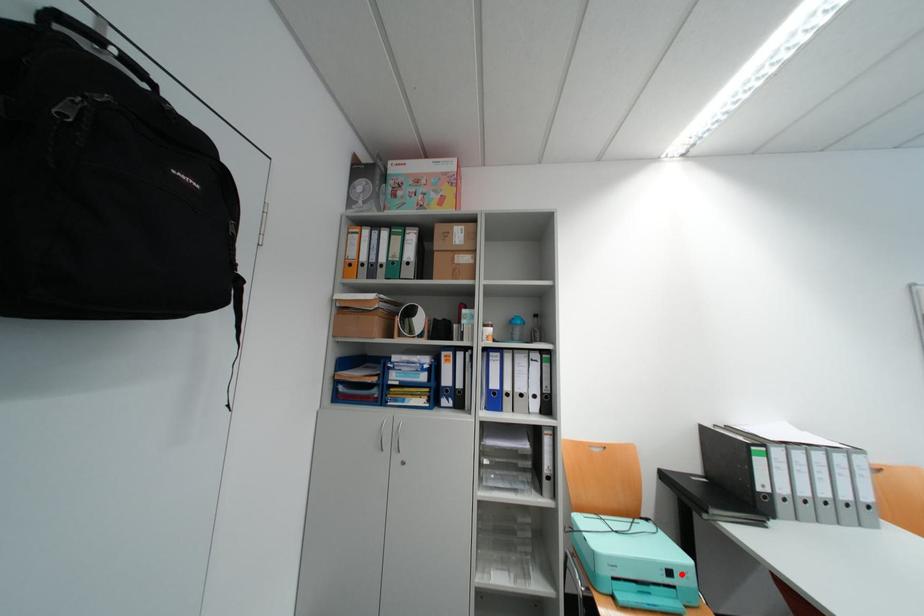
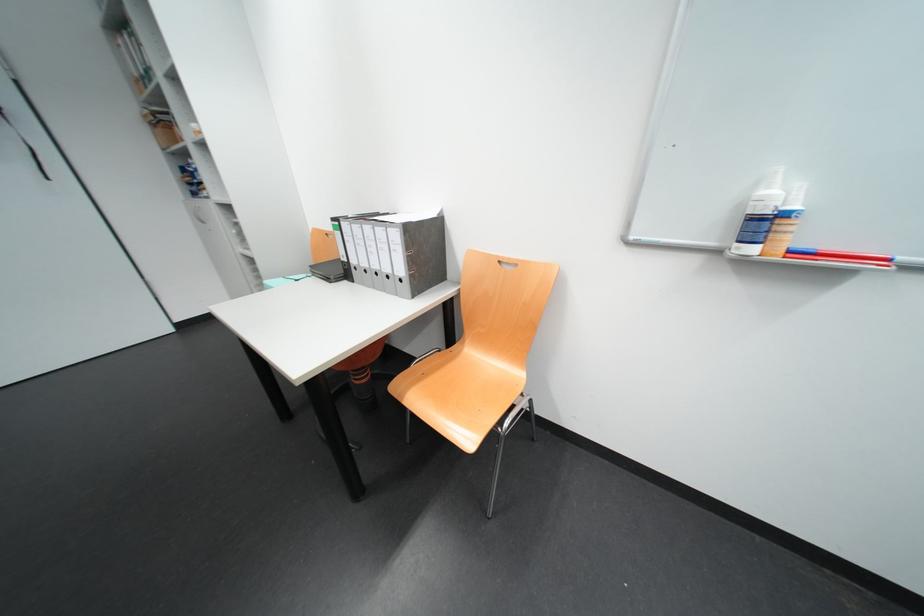
Question: I am providing you with two images of the same scene from different viewpoints. A red point is marked on the first image. At the location where the point appears in image 1, is it still visible in image 2?

Choices:
 (A) Yes
 (B) No

Answer: (B)